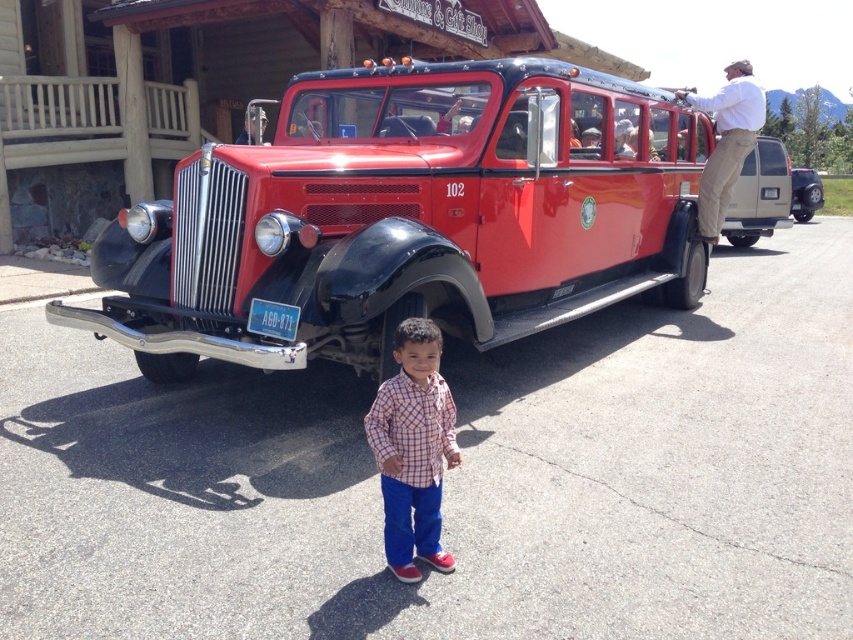
Question: Does khaki pants at upper right appear over metallic silver suv at right?

Choices:
 (A) yes
 (B) no

Answer: (B)

Question: Based on their relative distances, which object is farther from the metallic silver suv at right?

Choices:
 (A) khaki pants at upper right
 (B) plaid shirt at center

Answer: (B)

Question: From the image, what is the correct spatial relationship of shiny red bus at center in relation to metallic silver suv at right?

Choices:
 (A) left
 (B) right

Answer: (A)

Question: Which point is closer to the camera?

Choices:
 (A) (264, 209)
 (B) (801, 188)
 (C) (409, 541)
 (D) (730, 157)

Answer: (C)

Question: Which of the following is the farthest from the observer?

Choices:
 (A) (709, 163)
 (B) (405, 433)
 (C) (535, 104)
 (D) (805, 188)

Answer: (D)

Question: Can you confirm if khaki pants at upper right is positioned to the right of metallic silver suv at right?

Choices:
 (A) yes
 (B) no

Answer: (B)